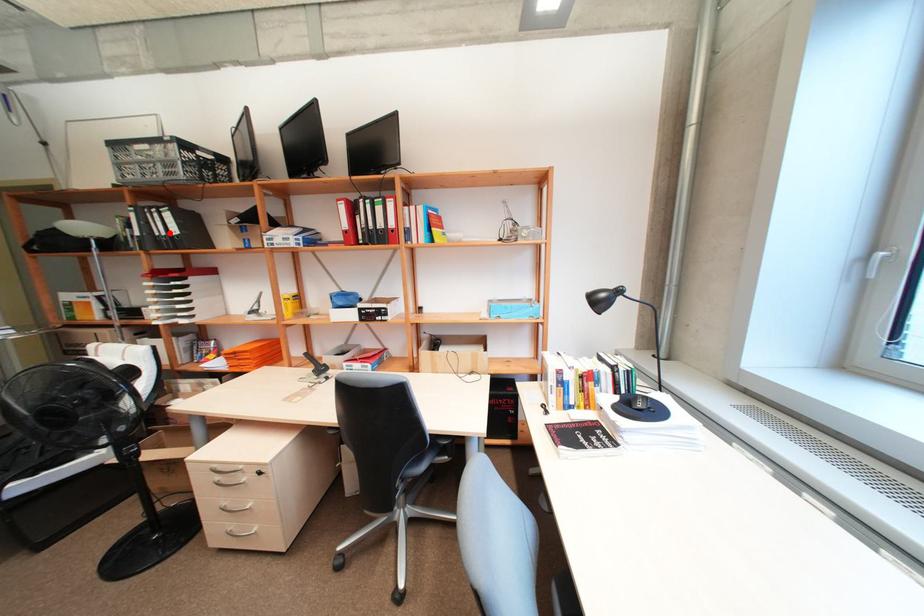
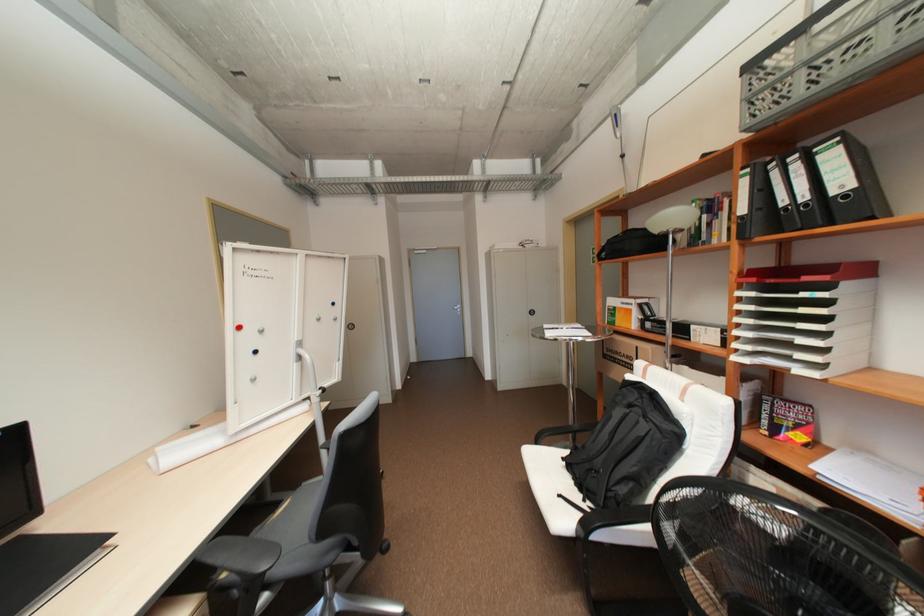
In the second image, find the point that corresponds to the highlighted location in the first image.

(810, 197)